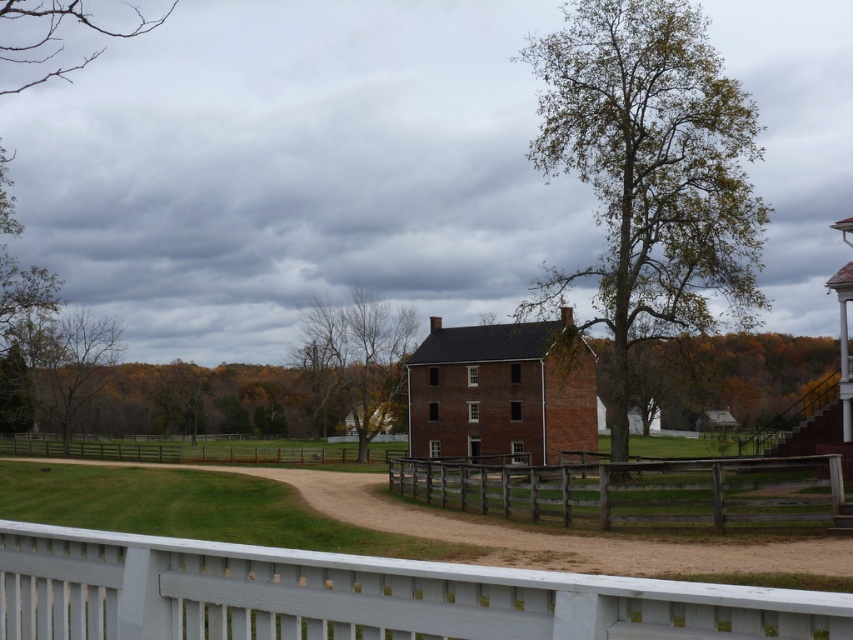
Is point (607, 355) positioned behind point (73, 452)?

Yes, it is behind point (73, 452).

Image resolution: width=853 pixels, height=640 pixels. In order to click on green leafy tree at center-right in this screenshot , I will do 727,376.

Does point (694, 403) come closer to viewer compared to point (331, 452)?

No, (694, 403) is behind (331, 452).

Locate an element on the screen. Image resolution: width=853 pixels, height=640 pixels. green leafy tree at center-right is located at coordinates (727, 376).

Between wooden planks at lower center and bare branches at upper left, which one has less height?

→ Standing shorter between the two is wooden planks at lower center.

The width and height of the screenshot is (853, 640). What do you see at coordinates (636, 490) in the screenshot?
I see `wooden planks at lower center` at bounding box center [636, 490].

Is point (792, 502) behind point (3, 90)?

No, (792, 502) is in front of (3, 90).

At what (x,y) coordinates should I click in order to perform the action: click on wooden planks at lower center. Please return your answer as a coordinate pair (x, y). Looking at the image, I should click on (636, 490).

What do you see at coordinates (648, 172) in the screenshot? The width and height of the screenshot is (853, 640). I see `green leafy tree at center` at bounding box center [648, 172].

Between point (619, 285) and point (32, 45), which one is positioned behind?

The point (32, 45) is more distant.

Find the location of a particular element. This screenshot has height=640, width=853. green leafy tree at center is located at coordinates (648, 172).